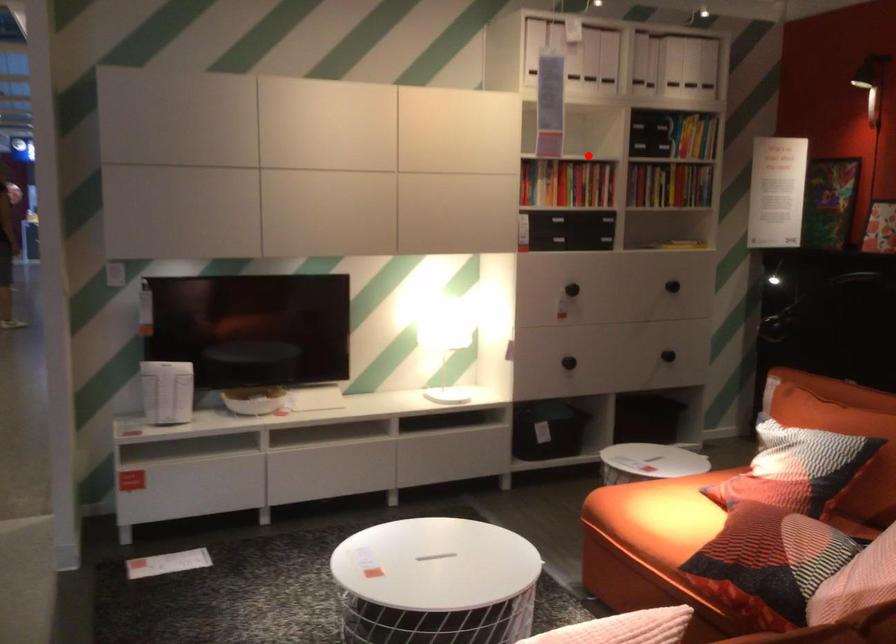
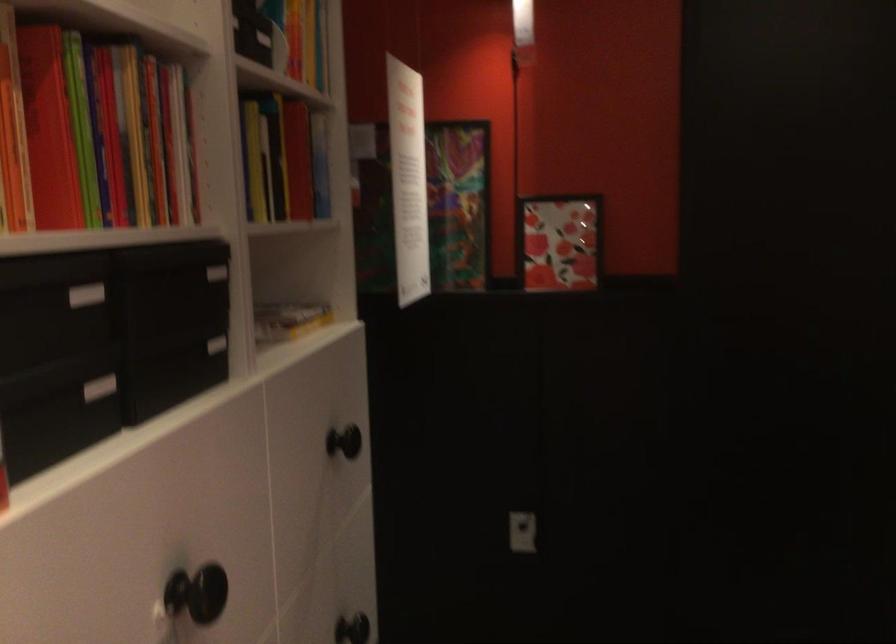
Question: I am providing you with two images of the same scene from different viewpoints. Image1 has a red point marked. In image2, the corresponding 3D location appears at what relative position? Reply with the corresponding letter.

Choices:
 (A) Closer
 (B) Farther

Answer: (A)